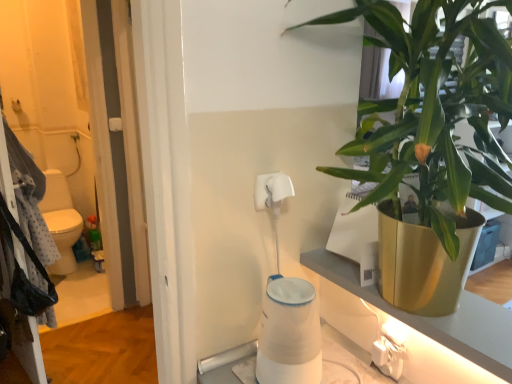
Question: Which direction should I rotate to look at white matte toilet paper at center, which ranks as the second toilet paper in top-to-bottom order?

Choices:
 (A) left
 (B) right

Answer: (B)

Question: From the image's perspective, would you say white plastic electric outlet at lower right is positioned over white matte toilet paper at upper center, which is the second toilet paper in bottom-to-top order?

Choices:
 (A) no
 (B) yes

Answer: (A)

Question: Considering the relative sizes of white plastic electric outlet at lower right and white matte toilet paper at upper center, which ranks as the 1th toilet paper in top-to-bottom order, in the image provided, is white plastic electric outlet at lower right thinner than white matte toilet paper at upper center, which ranks as the 1th toilet paper in top-to-bottom order,?

Choices:
 (A) no
 (B) yes

Answer: (A)

Question: Is white plastic electric outlet at lower right looking in the opposite direction of white matte toilet paper at upper center, which ranks as the 1th toilet paper in top-to-bottom order?

Choices:
 (A) no
 (B) yes

Answer: (A)

Question: Is white plastic electric outlet at lower right positioned far away from white matte toilet paper at upper center, which is the second toilet paper in bottom-to-top order?

Choices:
 (A) yes
 (B) no

Answer: (B)

Question: Does white plastic electric outlet at lower right touch white matte toilet paper at upper center, which is the second toilet paper in bottom-to-top order?

Choices:
 (A) no
 (B) yes

Answer: (A)

Question: Is white plastic electric outlet at lower right at the left side of white matte toilet paper at upper center, which ranks as the 1th toilet paper in top-to-bottom order?

Choices:
 (A) yes
 (B) no

Answer: (B)

Question: From a real-world perspective, is spotted fabric laundry at left located beneath white matte toilet paper at center, arranged as the 1th toilet paper when ordered from the bottom?

Choices:
 (A) yes
 (B) no

Answer: (A)

Question: From the image's perspective, does spotted fabric laundry at left appear lower than white matte toilet paper at center, which ranks as the second toilet paper in top-to-bottom order?

Choices:
 (A) no
 (B) yes

Answer: (A)

Question: Is spotted fabric laundry at left next to white matte toilet paper at center, arranged as the 1th toilet paper when ordered from the bottom?

Choices:
 (A) yes
 (B) no

Answer: (B)

Question: Is spotted fabric laundry at left closer to camera compared to white matte toilet paper at center, arranged as the 1th toilet paper when ordered from the bottom?

Choices:
 (A) no
 (B) yes

Answer: (A)

Question: Considering the relative positions of spotted fabric laundry at left and white matte toilet paper at center, which ranks as the second toilet paper in top-to-bottom order, in the image provided, is spotted fabric laundry at left behind white matte toilet paper at center, which ranks as the second toilet paper in top-to-bottom order,?

Choices:
 (A) no
 (B) yes

Answer: (B)

Question: Can you confirm if spotted fabric laundry at left is smaller than white matte toilet paper at center, which ranks as the second toilet paper in top-to-bottom order?

Choices:
 (A) yes
 (B) no

Answer: (B)

Question: Is white matte toilet paper at upper center, which ranks as the 1th toilet paper in top-to-bottom order, with spotted fabric laundry at left?

Choices:
 (A) yes
 (B) no

Answer: (B)